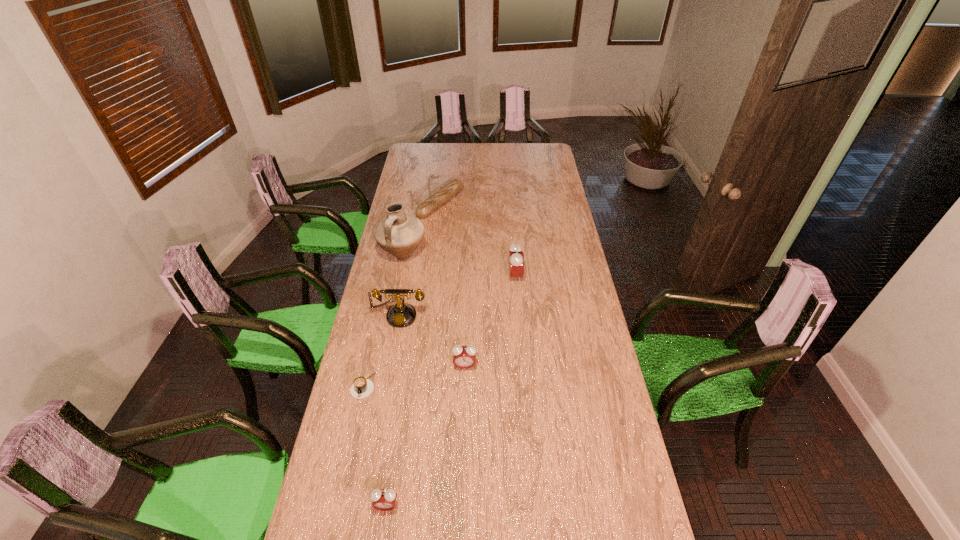
The alarm clocks are evenly distributed in the image. To maintain this, where would you place another alarm clock on the right? Please point to a free space. Please provide its 2D coordinates. Your answer should be formatted as a tuple, i.e. [(x, y)], where the tuple contains the x and y coordinates of a point satisfying the conditions above.

[(550, 214)]